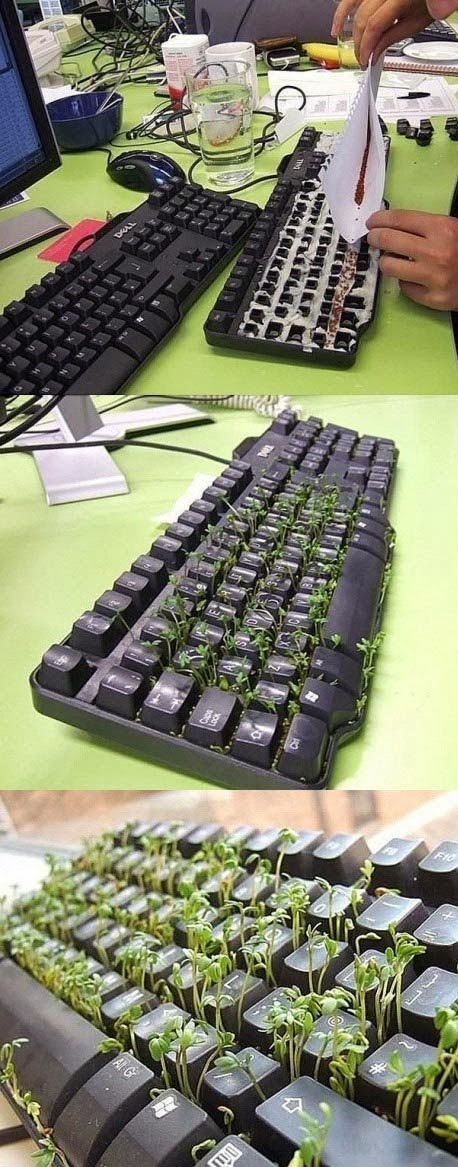
The height and width of the screenshot is (1167, 458). I want to click on green table, so click(431, 503), click(393, 336).